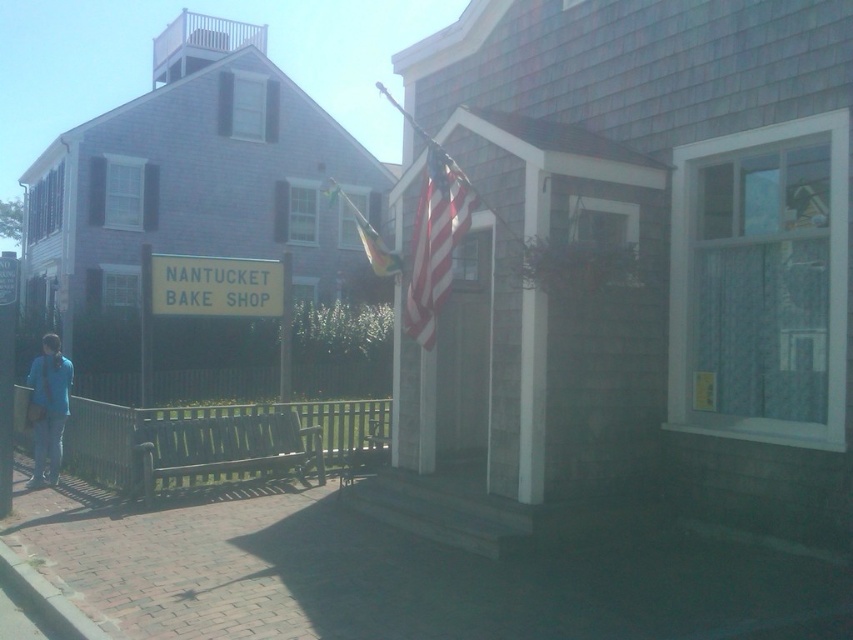
Question: Among these objects, which one is nearest to the camera?

Choices:
 (A) american flag at center
 (B) brick pavement at lower left
 (C) blue fabric bag at lower left

Answer: (B)

Question: Considering the relative positions of american flag at center and blue fabric bag at lower left in the image provided, where is american flag at center located with respect to blue fabric bag at lower left?

Choices:
 (A) below
 (B) above

Answer: (B)

Question: Which object appears farthest from the camera in this image?

Choices:
 (A) american flag at center
 (B) brick pavement at lower left

Answer: (A)

Question: Considering the relative positions of brick pavement at lower left and blue fabric bag at lower left in the image provided, where is brick pavement at lower left located with respect to blue fabric bag at lower left?

Choices:
 (A) above
 (B) below

Answer: (B)

Question: Is brick pavement at lower left closer to camera compared to blue fabric bag at lower left?

Choices:
 (A) yes
 (B) no

Answer: (A)

Question: Which point is farther to the camera?

Choices:
 (A) brick pavement at lower left
 (B) american flag at center

Answer: (B)